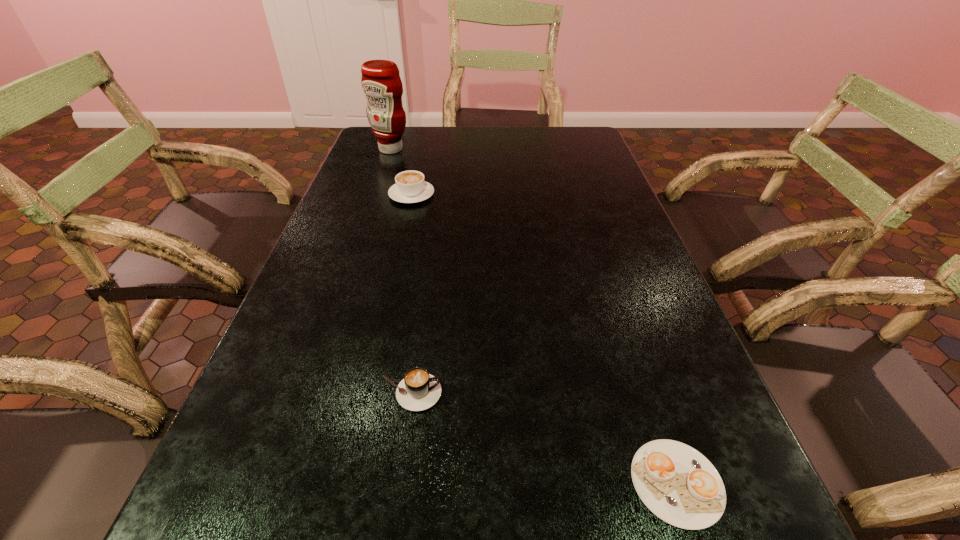
At what (x,y) coordinates should I click in order to perform the action: click on vacant point located between the tallest object and the shortest cappuccino. Please return your answer as a coordinate pair (x, y). The height and width of the screenshot is (540, 960). Looking at the image, I should click on (534, 316).

Where is `vacant space in between the tallest cappuccino and the rightmost object`? The width and height of the screenshot is (960, 540). vacant space in between the tallest cappuccino and the rightmost object is located at coordinates (544, 339).

Identify which object is the third nearest to the rightmost cappuccino. Please provide its 2D coordinates. Your answer should be formatted as a tuple, i.e. [(x, y)], where the tuple contains the x and y coordinates of a point satisfying the conditions above.

[(381, 83)]

Locate which object is the second closest to the second shortest cappuccino. Please provide its 2D coordinates. Your answer should be formatted as a tuple, i.e. [(x, y)], where the tuple contains the x and y coordinates of a point satisfying the conditions above.

[(410, 187)]

Locate which cappuccino is the second closest to the tallest object. Please provide its 2D coordinates. Your answer should be formatted as a tuple, i.e. [(x, y)], where the tuple contains the x and y coordinates of a point satisfying the conditions above.

[(419, 390)]

In order to click on cappuccino that is the closest one to the third shortest object in this screenshot , I will do `click(419, 390)`.

You are a GUI agent. You are given a task and a screenshot of the screen. Output one action in this format:
    pyautogui.click(x=<x>, y=<y>)
    Task: Click on the vacant position in the image that satisfies the following two spatial constraints: 1. with the handle on the side of the second nearest cappuccino; 2. on the left side of the shortest cappuccino
    
    Given the screenshot: What is the action you would take?
    pyautogui.click(x=397, y=483)

Locate an element on the screen. This screenshot has width=960, height=540. vacant region that satisfies the following two spatial constraints: 1. with the handle on the side of the second tallest cappuccino; 2. on the right side of the nearest object is located at coordinates (397, 483).

Find the location of a particular element. This screenshot has width=960, height=540. vacant space that satisfies the following two spatial constraints: 1. on the back side of the shortest cappuccino; 2. with the handle on the side of the second farthest cappuccino is located at coordinates (647, 393).

Image resolution: width=960 pixels, height=540 pixels. In order to click on vacant area in the image that satisfies the following two spatial constraints: 1. with the handle on the side of the shortest object; 2. on the left side of the third tallest object in this screenshot , I will do `click(397, 483)`.